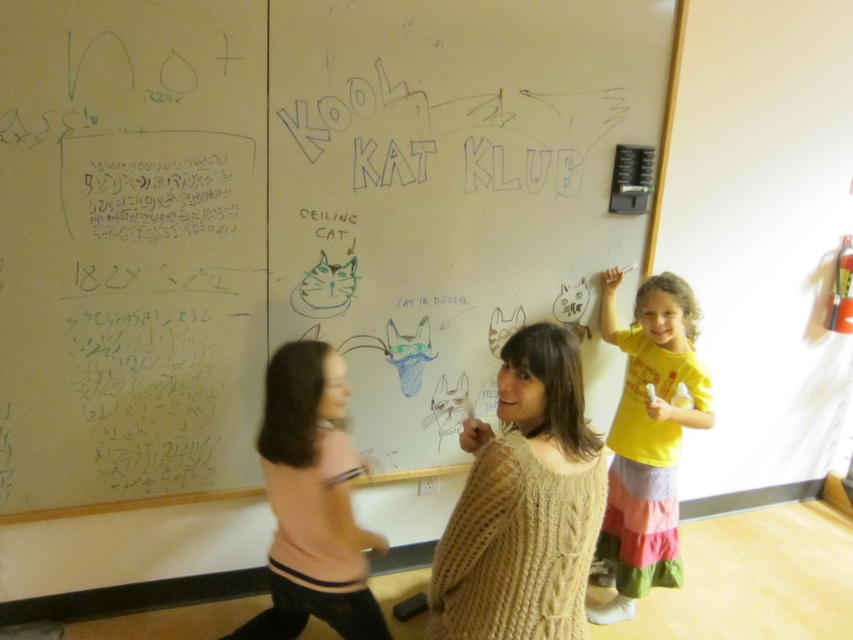
You are organizing a school event and need to arrange two shirts for a mascot costume. The mascot costume requires the pink fabric shirt at lower left and the yellow cotton shirt at upper right. If you want to place them side by side on a shelf, which shirt should be placed on the left side of the shelf?

The pink fabric shirt at lower left should be placed on the left side of the shelf because it is already positioned to the left of the yellow cotton shirt at upper right in the image.